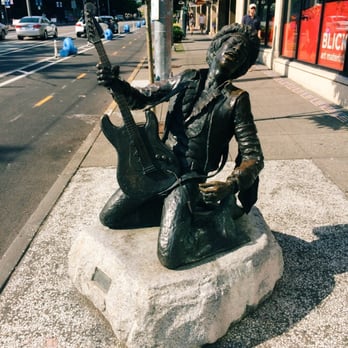
You are a GUI agent. You are given a task and a screenshot of the screen. Output one action in this format:
    pyautogui.click(x=<x>, y=<y>)
    Task: Click on the statue
    The height and width of the screenshot is (348, 348).
    Given the screenshot: What is the action you would take?
    pyautogui.click(x=191, y=137)